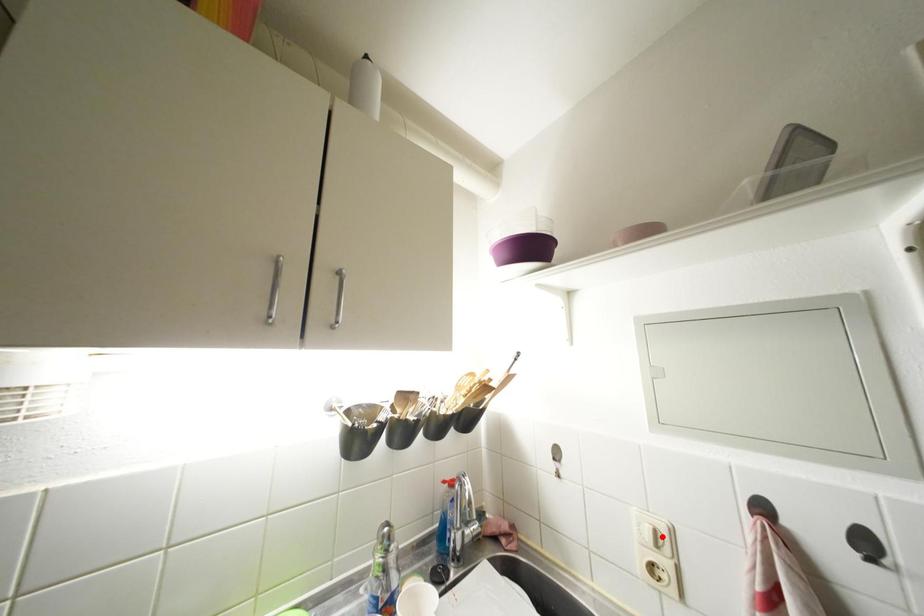
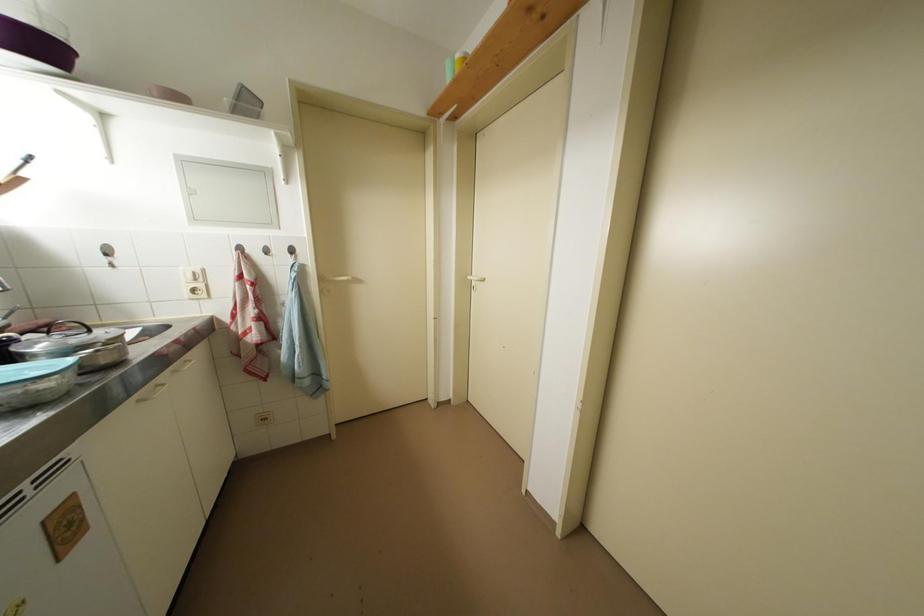
Locate, in the second image, the point that corresponds to the highlighted location in the first image.

(201, 277)